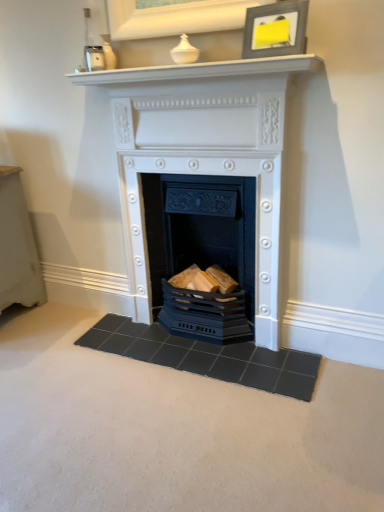
The width and height of the screenshot is (384, 512). I want to click on blank space above dark gray tile doormat at center (from a real-world perspective), so click(x=234, y=343).